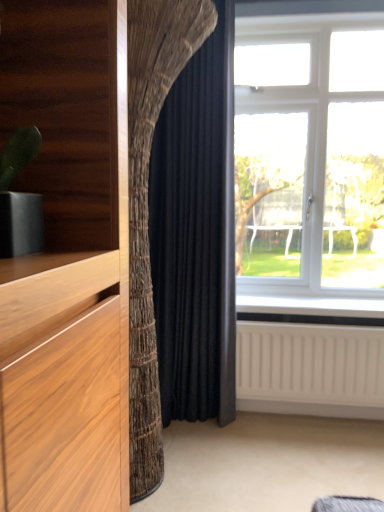
Question: From a real-world perspective, is white plastic window at right located beneath black velvet curtain at center?

Choices:
 (A) yes
 (B) no

Answer: (B)

Question: Can you see white plastic window at right touching black velvet curtain at center?

Choices:
 (A) yes
 (B) no

Answer: (B)

Question: From the image's perspective, is white plastic window at right located beneath black velvet curtain at center?

Choices:
 (A) yes
 (B) no

Answer: (B)

Question: Can you confirm if white plastic window at right is positioned to the left of black velvet curtain at center?

Choices:
 (A) no
 (B) yes

Answer: (A)

Question: Would you say black velvet curtain at center is part of white plastic window at right's contents?

Choices:
 (A) yes
 (B) no

Answer: (B)

Question: Is white plastic window at right in front of black velvet curtain at center?

Choices:
 (A) yes
 (B) no

Answer: (B)

Question: Considering the relative positions of black velvet curtain at center and white textured radiator at lower right in the image provided, is black velvet curtain at center to the left of white textured radiator at lower right from the viewer's perspective?

Choices:
 (A) no
 (B) yes

Answer: (B)

Question: Considering the relative positions of black velvet curtain at center and white textured radiator at lower right in the image provided, is black velvet curtain at center to the right of white textured radiator at lower right from the viewer's perspective?

Choices:
 (A) no
 (B) yes

Answer: (A)

Question: Is black velvet curtain at center taller than white textured radiator at lower right?

Choices:
 (A) yes
 (B) no

Answer: (A)

Question: From a real-world perspective, does black velvet curtain at center stand above white textured radiator at lower right?

Choices:
 (A) yes
 (B) no

Answer: (A)

Question: Would you say white textured radiator at lower right is part of black velvet curtain at center's contents?

Choices:
 (A) no
 (B) yes

Answer: (A)

Question: Would you say black velvet curtain at center is outside white textured radiator at lower right?

Choices:
 (A) no
 (B) yes

Answer: (B)

Question: Considering the relative positions of black velvet curtain at center and white plastic window at right in the image provided, is black velvet curtain at center to the left of white plastic window at right from the viewer's perspective?

Choices:
 (A) no
 (B) yes

Answer: (B)